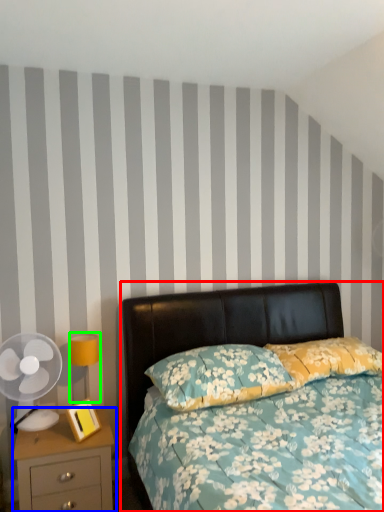
Question: Which object is the closest to the bed (highlighted by a red box)? Choose among these: nightstand (highlighted by a blue box) or bedside lamp (highlighted by a green box).

Choices:
 (A) nightstand
 (B) bedside lamp

Answer: (B)